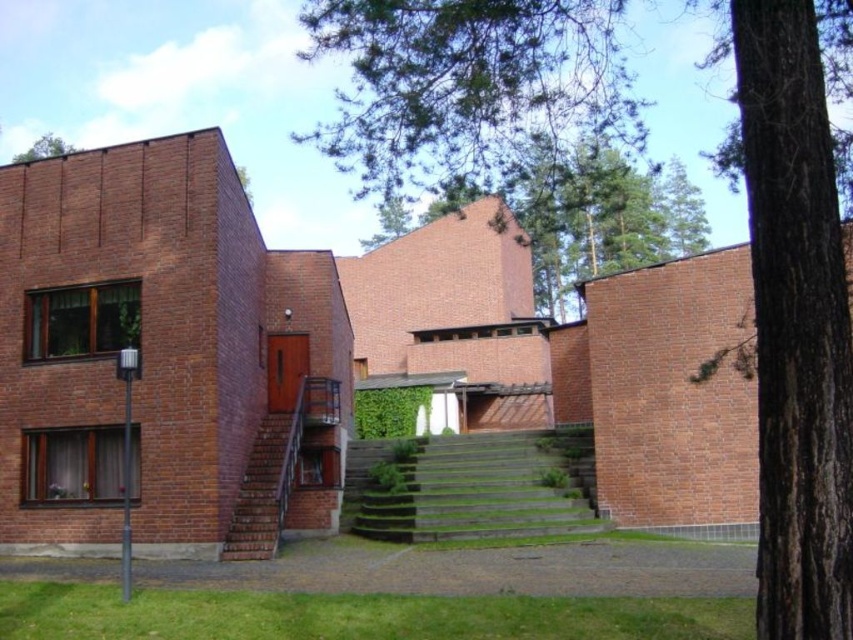
Who is shorter, green leafy tree at upper center or green leafy tree at upper left?

With less height is green leafy tree at upper center.

Who is higher up, green leafy tree at upper center or green leafy tree at upper left?

green leafy tree at upper left is higher up.

Is point (590, 209) behind point (16, 161)?

No.

You are a GUI agent. You are given a task and a screenshot of the screen. Output one action in this format:
    pyautogui.click(x=<x>, y=<y>)
    Task: Click on the green leafy tree at upper center
    The width and height of the screenshot is (853, 640).
    Given the screenshot: What is the action you would take?
    pyautogui.click(x=576, y=212)

Does point (697, 198) come closer to viewer compared to point (454, 476)?

That is False.

Where is `green leafy tree at upper center`? This screenshot has width=853, height=640. green leafy tree at upper center is located at coordinates (576, 212).

Between green leafy tree at upper center and brick stairs at lower left, which one has less height?

With less height is brick stairs at lower left.

Who is more distant from viewer, (645, 202) or (289, 451)?

The point (645, 202) is behind.

Find the location of `green leafy tree at upper center`. green leafy tree at upper center is located at coordinates [x=576, y=212].